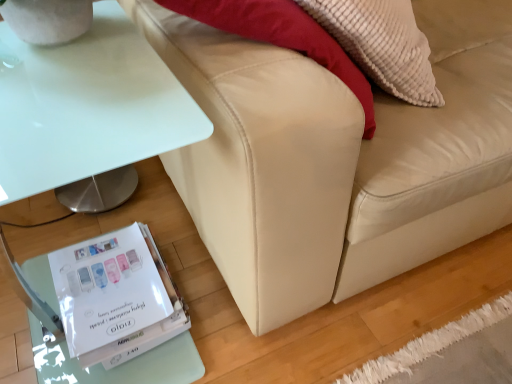
Identify the location of blank space situated above white glossy table at lower left (from a real-world perspective). (71, 76).